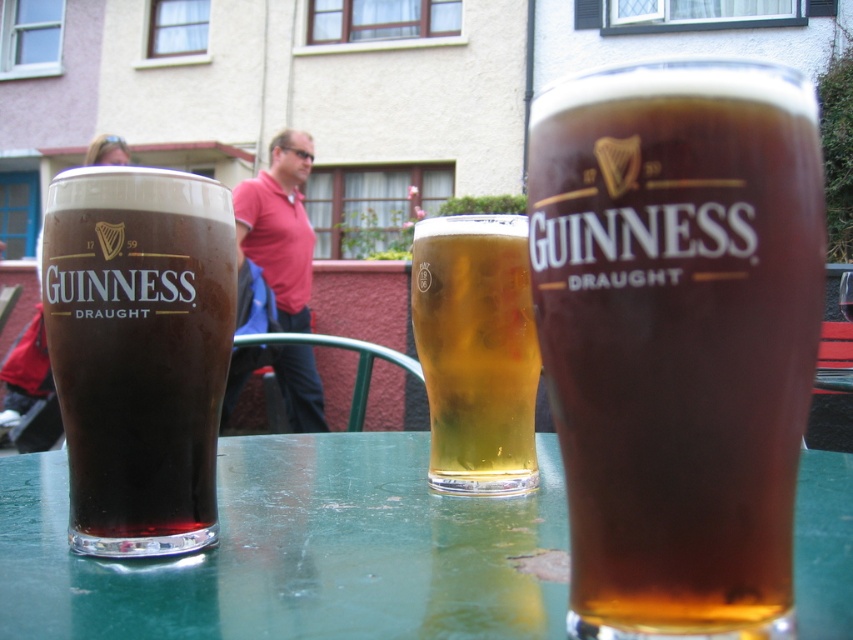
You are a GUI agent. You are given a task and a screenshot of the screen. Output one action in this format:
    pyautogui.click(x=<x>, y=<y>)
    Task: Click on the golden amber glass at center
    
    Given the screenshot: What is the action you would take?
    pyautogui.click(x=476, y=352)

Between point (486, 250) and point (306, 346), which one is positioned behind?

Point (306, 346)

The height and width of the screenshot is (640, 853). Describe the element at coordinates (476, 352) in the screenshot. I see `golden amber glass at center` at that location.

The width and height of the screenshot is (853, 640). I want to click on golden amber glass at center, so click(476, 352).

Is green glossy table at center further to the viewer compared to pink fabric shirt at center?

No, it is not.

Which is more to the left, green glossy table at center or pink fabric shirt at center?

pink fabric shirt at center

Image resolution: width=853 pixels, height=640 pixels. I want to click on green glossy table at center, so click(297, 552).

Which is below, green glossy table at center or golden amber glass at center?

green glossy table at center

Does point (32, 616) come behind point (436, 336)?

No, (32, 616) is in front of (436, 336).

Measure the distance between point (136, 630) and camera.

Point (136, 630) and camera are 9.36 inches apart from each other.

At what (x,y) coordinates should I click in order to perform the action: click on green glossy table at center. Please return your answer as a coordinate pair (x, y). This screenshot has height=640, width=853. Looking at the image, I should click on (297, 552).